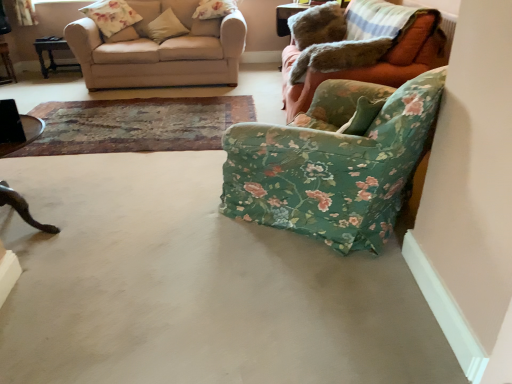
Question: Is point (234, 56) closer or farther from the camera than point (24, 130)?

Choices:
 (A) farther
 (B) closer

Answer: (A)

Question: From a real-world perspective, is beige fabric couch at upper left, the second studio couch when ordered from right to left, physically located above or below wooden dark brown table at left, which ranks as the 3th table in back-to-front order?

Choices:
 (A) below
 (B) above

Answer: (B)

Question: Considering the real-world distances, which object is closest to the wooden dark brown table at left, which is the first table in bottom-to-top order?

Choices:
 (A) beige fabric couch at upper left, the second studio couch when ordered from right to left
 (B) wooden dark brown table at left, the 3th table positioned from the bottom
 (C) beige fabric pillow at upper left, the 3th pillow when ordered from left to right
 (D) floral fabric pillow at upper center, which appears as the fourth pillow when viewed from the left
 (E) floral fabric armchair at right, placed as the 2th studio couch when sorted from left to right

Answer: (A)

Question: Which object is positioned closest to the wooden dark brown table at left, the second table viewed from the left?

Choices:
 (A) gray concrete floor at lower right
 (B) beige fabric pillow at upper left, the 3th pillow when ordered from left to right
 (C) floral fabric armchair at lower right
 (D) brushed metal table at left, the second table from the bottom
 (E) fluffy beige pillow at upper left, which ranks as the third pillow in right-to-left order

Answer: (D)